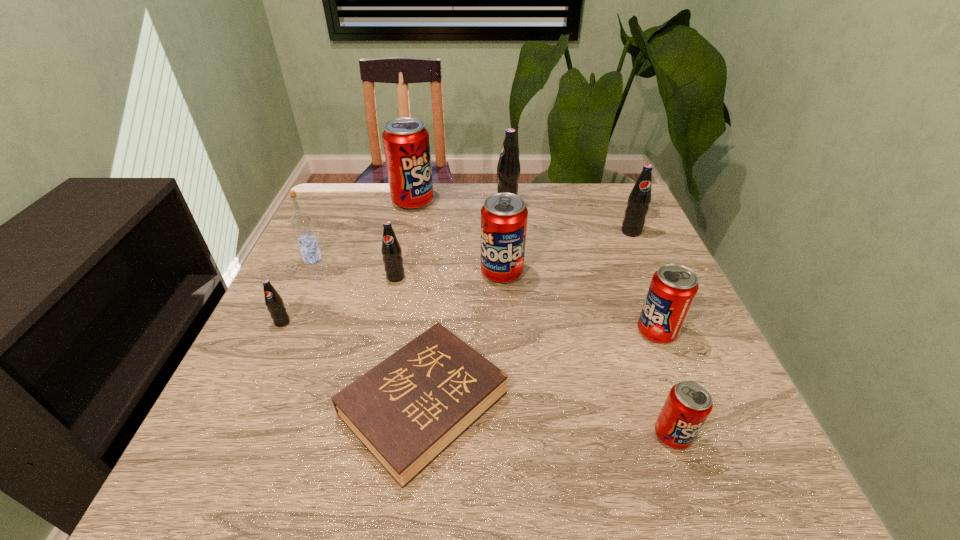
Find the location of a particular element. This screenshot has width=960, height=540. vacant space located 0.100m on the front label of the biggest black pop is located at coordinates (461, 207).

Find the location of a particular element. The height and width of the screenshot is (540, 960). free region located 0.240m on the front label of the biggest black pop is located at coordinates (413, 207).

You are a GUI agent. You are given a task and a screenshot of the screen. Output one action in this format:
    pyautogui.click(x=<x>, y=<y>)
    Task: Click on the free space located 0.370m on the front label of the second farthest black pop
    This screenshot has width=960, height=540.
    Given the screenshot: What is the action you would take?
    pyautogui.click(x=682, y=345)

Locate an element on the screen. free space located 0.140m on the back of the second biggest red soda can is located at coordinates (499, 227).

At what (x,y) coordinates should I click in order to perform the action: click on free location located 0.050m on the front of the blue vodka. Please return your answer as a coordinate pair (x, y). Looking at the image, I should click on (304, 278).

This screenshot has width=960, height=540. Identify the location of vacant space located on the front label of the third farthest black pop. (372, 387).

The height and width of the screenshot is (540, 960). Identify the location of vacant space located on the left of the third farthest red soda can. (450, 332).

The height and width of the screenshot is (540, 960). What are the coordinates of `vacant point located 0.210m on the front label of the nearest black pop` in the screenshot? It's located at (239, 417).

Identify the location of vacant space positioned 0.290m on the left of the nearest soda can. (483, 435).

Find the location of a particular element. free location located 0.240m on the back of the shortest object is located at coordinates (439, 266).